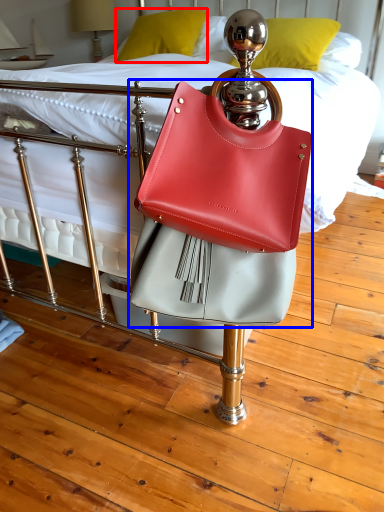
Question: Which of the following is the closest to the observer, pillow (highlighted by a red box) or handbag (highlighted by a blue box)?

Choices:
 (A) pillow
 (B) handbag

Answer: (B)